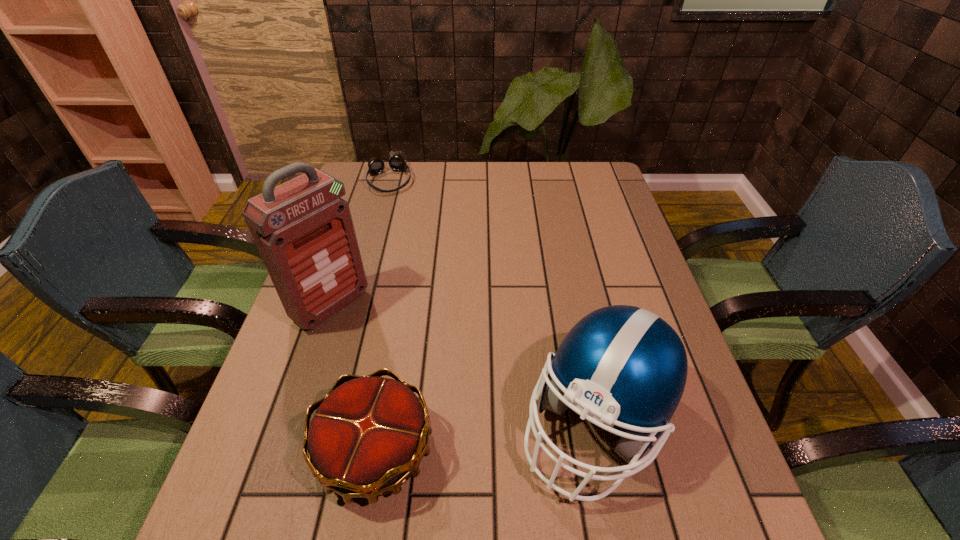
Find the location of a particular element. vacant space located 0.150m through the lenses of the goggles is located at coordinates (399, 221).

Identify the location of free space located on the front-facing side of the tallest object. (474, 421).

Locate an element on the screen. This screenshot has width=960, height=540. vacant region located 0.100m on the front-facing side of the tallest object is located at coordinates (379, 346).

Where is `vacant space situated 0.300m on the front-facing side of the tallest object`? Image resolution: width=960 pixels, height=540 pixels. vacant space situated 0.300m on the front-facing side of the tallest object is located at coordinates (442, 396).

The width and height of the screenshot is (960, 540). In order to click on object located in the far edge section of the desktop in this screenshot , I will do `click(396, 161)`.

I want to click on crown that is positioned at the near edge, so click(x=366, y=439).

You are a GUI agent. You are given a task and a screenshot of the screen. Output one action in this format:
    pyautogui.click(x=<x>, y=<y>)
    Task: Click on the football helmet located in the near edge section of the desktop
    
    Given the screenshot: What is the action you would take?
    pyautogui.click(x=623, y=366)

The width and height of the screenshot is (960, 540). I want to click on crown at the left edge, so click(366, 439).

This screenshot has height=540, width=960. Identify the location of goggles at the left edge. (396, 161).

I want to click on the first-aid kit that is at the left edge, so click(304, 232).